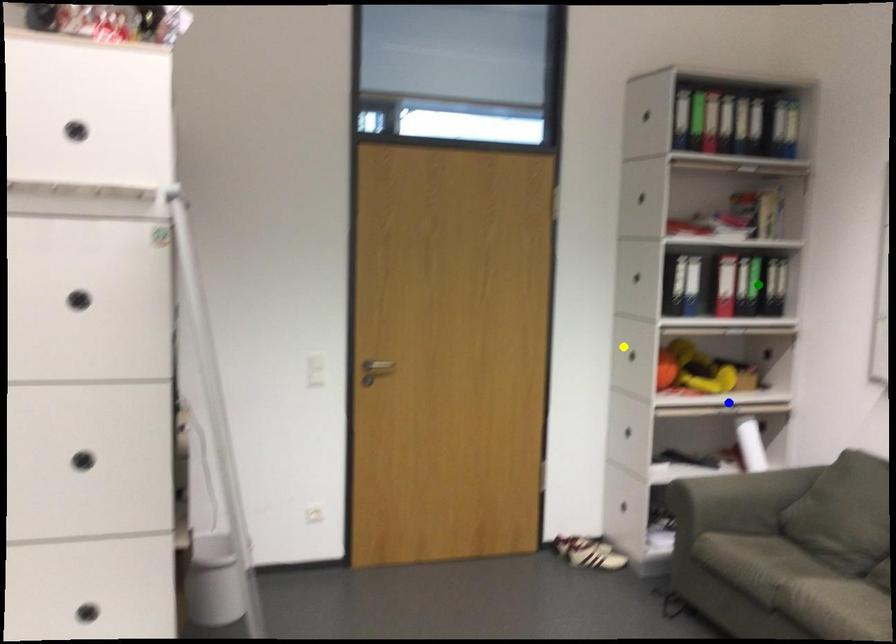
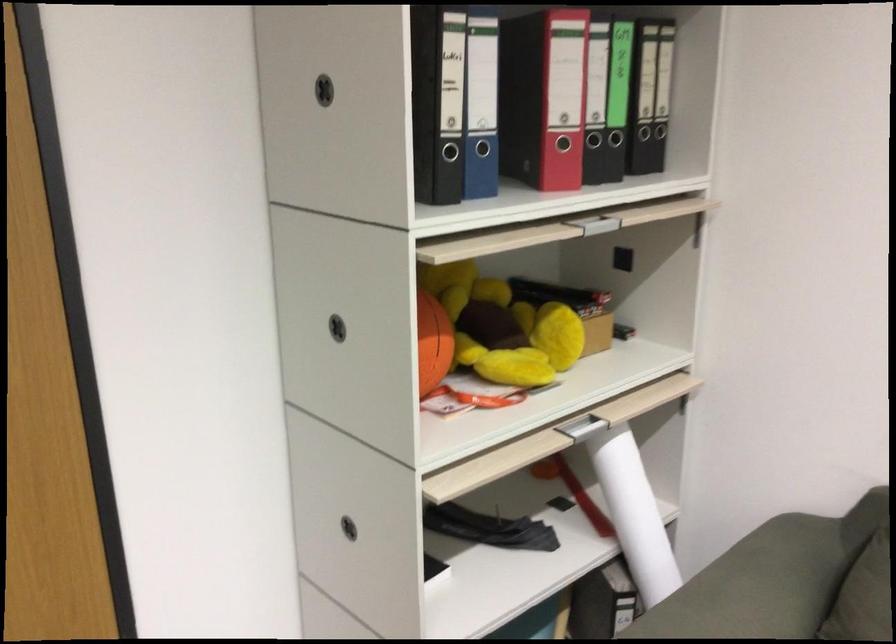
I am providing you with two images of the same scene from different viewpoints. Three points are marked in image1. Which point corresponds to a part or object that is occluded in image2?In image1, three points are marked. Which of them correspond to a part or object that is occluded in image2?Among the three points shown in image1, which one corresponds to a part or object that is no longer visible due to occlusion in image2?

Invisible in image2: green point.